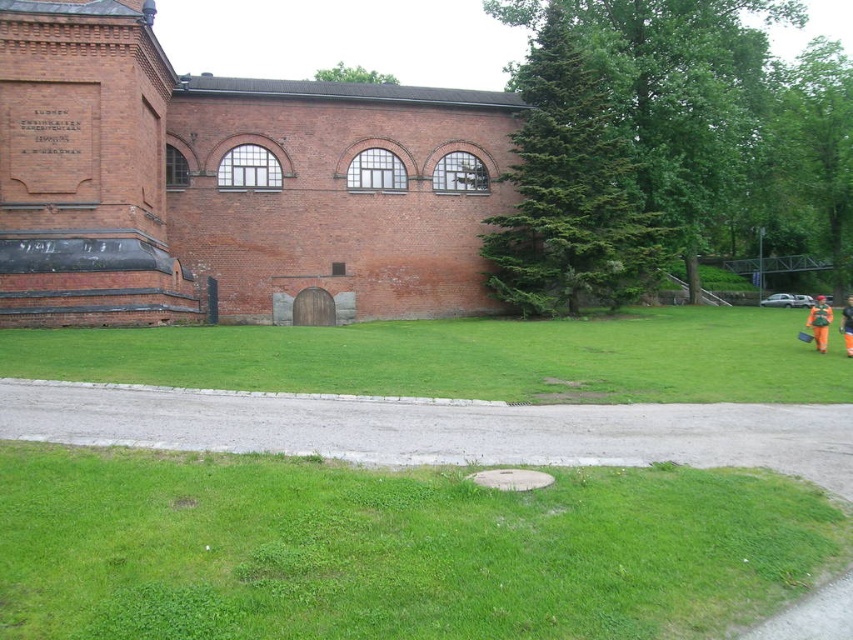
In the scene shown: Between orange reflective vest at lower right and orange reflective suit at right, which one appears on the left side from the viewer's perspective?

Positioned to the left is orange reflective suit at right.

Between orange reflective vest at lower right and orange reflective suit at right, which one appears on the right side from the viewer's perspective?

From the viewer's perspective, orange reflective vest at lower right appears more on the right side.

Measure the distance between orange reflective vest at lower right and camera.

orange reflective vest at lower right and camera are 17.26 meters apart from each other.

You are a GUI agent. You are given a task and a screenshot of the screen. Output one action in this format:
    pyautogui.click(x=<x>, y=<y>)
    Task: Click on the orange reflective vest at lower right
    The image size is (853, 640).
    Given the screenshot: What is the action you would take?
    pyautogui.click(x=819, y=323)

Can you confirm if green grass at lower center is positioned to the right of orange reflective vest at lower right?

Incorrect, green grass at lower center is not on the right side of orange reflective vest at lower right.

Based on the photo, is the position of green grass at lower center more distant than that of orange reflective vest at lower right?

No, it is not.

Which is behind, point (358, 528) or point (817, 304)?

Positioned behind is point (817, 304).

The image size is (853, 640). In order to click on green grass at lower center in this screenshot , I will do `click(393, 548)`.

Between point (541, 493) and point (843, 321), which one is positioned behind?

The point (843, 321) is behind.

Is point (334, 528) in front of point (846, 342)?

Yes.

In order to click on green grass at lower center in this screenshot , I will do `click(393, 548)`.